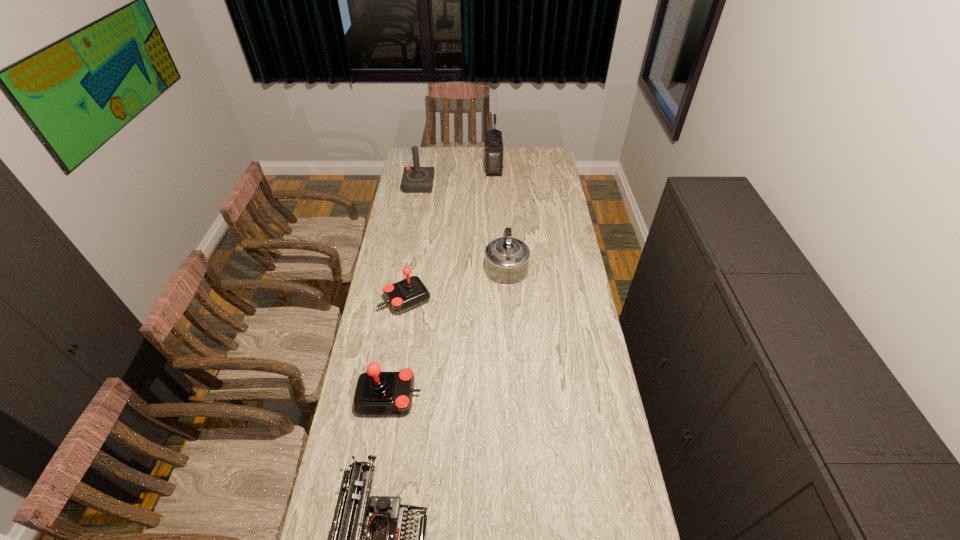
Locate an element on the screen. The width and height of the screenshot is (960, 540). free spot between the kettle and the fifth farthest object is located at coordinates (447, 330).

The height and width of the screenshot is (540, 960). Identify the location of unoccupied area between the nearest joystick and the kettle. (447, 330).

The image size is (960, 540). Find the location of `vacant space that is in between the second farthest joystick and the tallest object`. vacant space that is in between the second farthest joystick and the tallest object is located at coordinates (449, 235).

I want to click on vacant region between the lantern and the nearest joystick, so click(442, 283).

Select which object is the third closest to the kettle. Please provide its 2D coordinates. Your answer should be formatted as a tuple, i.e. [(x, y)], where the tuple contains the x and y coordinates of a point satisfying the conditions above.

[(416, 179)]

Choose which object is the fourth nearest neighbor to the nearest joystick. Please provide its 2D coordinates. Your answer should be formatted as a tuple, i.e. [(x, y)], where the tuple contains the x and y coordinates of a point satisfying the conditions above.

[(416, 179)]

Select which joystick is the third closest to the lantern. Please provide its 2D coordinates. Your answer should be formatted as a tuple, i.e. [(x, y)], where the tuple contains the x and y coordinates of a point satisfying the conditions above.

[(377, 393)]

Locate an element on the screen. joystick that is the third nearest to the shortest object is located at coordinates (416, 179).

Where is `free location that satisfies the following two spatial constraints: 1. on the front-facing side of the tallest object; 2. with the spout at the front of the kettle`? Image resolution: width=960 pixels, height=540 pixels. free location that satisfies the following two spatial constraints: 1. on the front-facing side of the tallest object; 2. with the spout at the front of the kettle is located at coordinates (497, 265).

Identify the location of vacant space that satisfies the following two spatial constraints: 1. on the front-facing side of the tallest object; 2. with the spout at the front of the kettle. (497, 265).